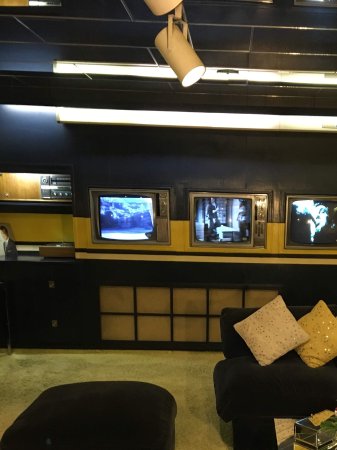
The height and width of the screenshot is (450, 337). In order to click on overhead directional light in this screenshot , I will do `click(164, 3)`, `click(178, 44)`.